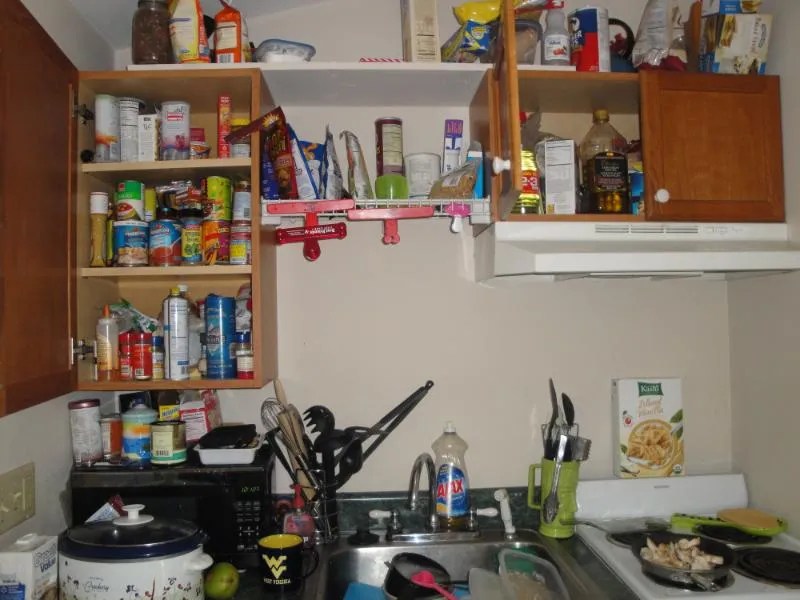
What are the coordinates of `sink` in the screenshot? It's located at (486, 549).